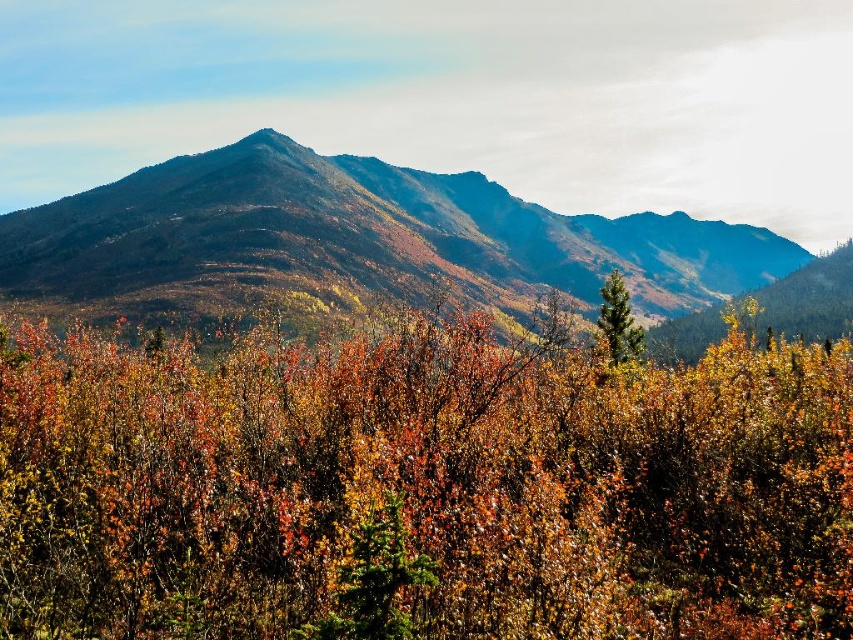
Question: Is smooth brown mountain range at center thinner than green matte tree at center?

Choices:
 (A) yes
 (B) no

Answer: (B)

Question: Which is nearer to the green matte tree at center?

Choices:
 (A) multicolored foliage at center
 (B) smooth brown mountain range at center

Answer: (A)

Question: Can you confirm if multicolored foliage at center is positioned to the right of smooth brown mountain range at center?

Choices:
 (A) yes
 (B) no

Answer: (B)

Question: Can you confirm if multicolored foliage at center is positioned below green matte tree at center?

Choices:
 (A) no
 (B) yes

Answer: (B)

Question: Which of these objects is positioned closest to the green matte tree at center?

Choices:
 (A) smooth brown mountain range at center
 (B) multicolored foliage at center

Answer: (B)

Question: Which point appears farthest from the camera in this image?

Choices:
 (A) (665, 282)
 (B) (618, 300)

Answer: (A)